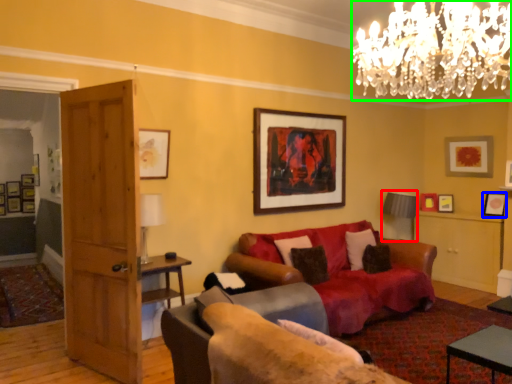
Question: Which is nearer to the lamp (highlighted by a red box)? picture frame (highlighted by a blue box) or lamp (highlighted by a green box).

Choices:
 (A) picture frame
 (B) lamp

Answer: (A)